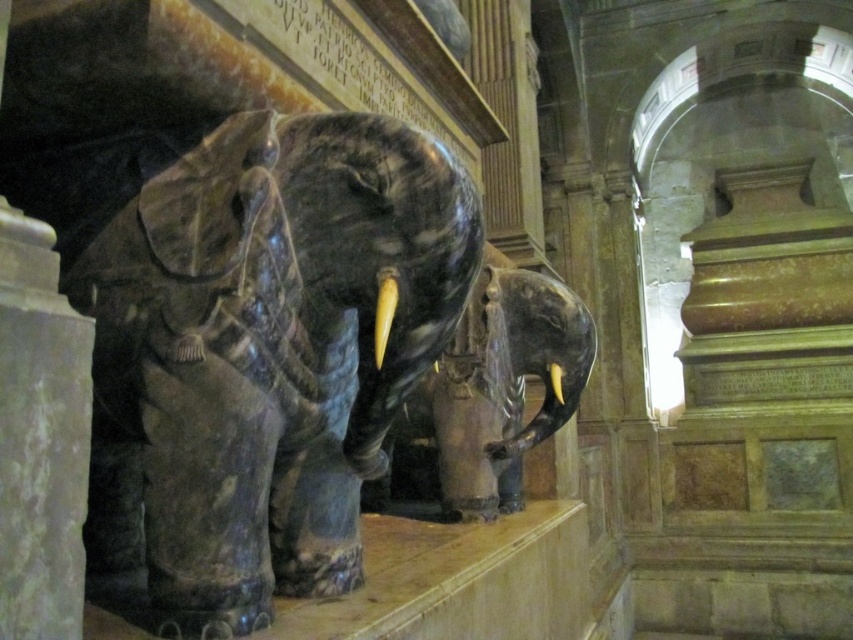
Question: Which of these objects is positioned closest to the white marble pillar at left?

Choices:
 (A) yellow polished tusk at center
 (B) shiny black elephant at center

Answer: (B)

Question: Can you confirm if white marble pillar at left is positioned above yellow polished tusk at center?

Choices:
 (A) yes
 (B) no

Answer: (A)

Question: Which point is farther to the camera?

Choices:
 (A) polished marble elephant at center
 (B) shiny black elephant at center

Answer: (B)

Question: Which of the following is the farthest from the observer?

Choices:
 (A) (553, 385)
 (B) (289, 116)

Answer: (A)

Question: Is polished marble elephant at center to the right of white glossy tusk at center from the viewer's perspective?

Choices:
 (A) yes
 (B) no

Answer: (B)

Question: Is polished marble elephant at center further to the viewer compared to shiny black elephant at center?

Choices:
 (A) no
 (B) yes

Answer: (A)